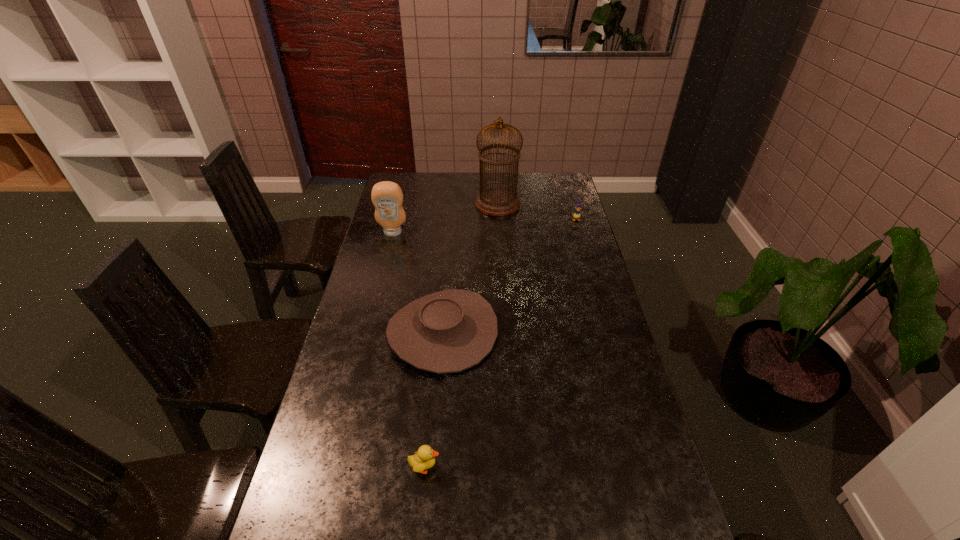
Locate which duckling ranks in proximity to the farthest object. Please provide its 2D coordinates. Your answer should be formatted as a tuple, i.e. [(x, y)], where the tuple contains the x and y coordinates of a point satisfying the conditions above.

[(576, 215)]

Identify the location of vacant space that satisfies the following two spatial constraints: 1. on the face of the farther duckling, where the monocle is placed; 2. on the front-facing side of the nearer duckling. (648, 467).